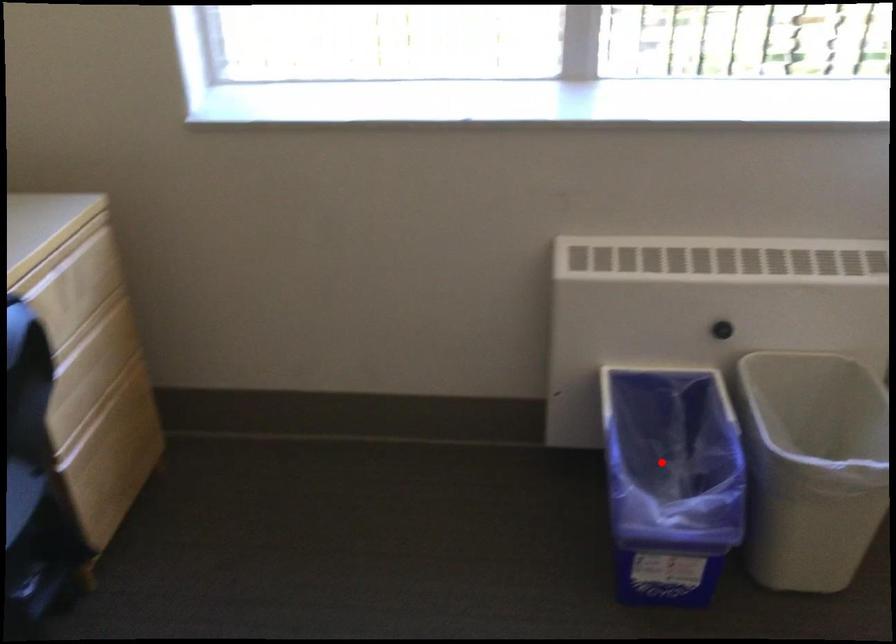
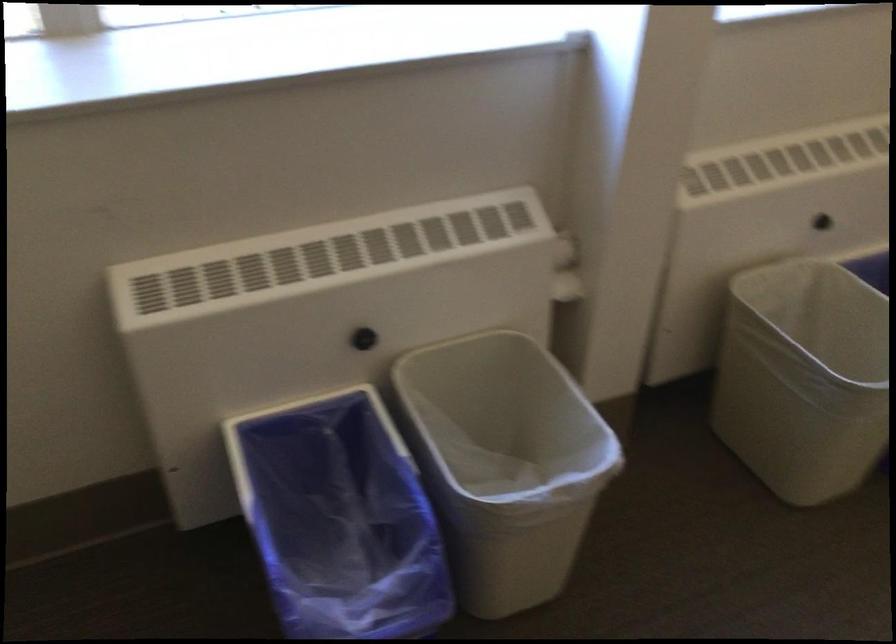
The point at the highlighted location is marked in the first image. Where is the corresponding point in the second image?

(339, 518)